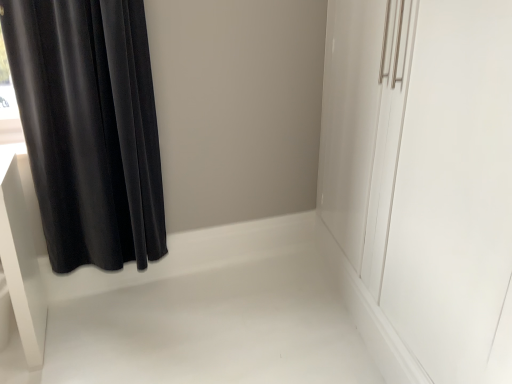
Question: Is the position of white glossy cabinet at right more distant than that of velvet black curtain at left?

Choices:
 (A) yes
 (B) no

Answer: (B)

Question: Does white glossy cabinet at right have a larger size compared to velvet black curtain at left?

Choices:
 (A) no
 (B) yes

Answer: (B)

Question: Is white glossy cabinet at right wider than velvet black curtain at left?

Choices:
 (A) no
 (B) yes

Answer: (B)

Question: From a real-world perspective, is white glossy cabinet at right located higher than velvet black curtain at left?

Choices:
 (A) yes
 (B) no

Answer: (B)

Question: From the image's perspective, is white glossy cabinet at right below velvet black curtain at left?

Choices:
 (A) no
 (B) yes

Answer: (B)

Question: Can you confirm if white glossy cabinet at right is thinner than velvet black curtain at left?

Choices:
 (A) no
 (B) yes

Answer: (A)

Question: Can you confirm if velvet black curtain at left is shorter than white glossy cabinet at right?

Choices:
 (A) yes
 (B) no

Answer: (A)

Question: Can you confirm if velvet black curtain at left is smaller than white glossy cabinet at right?

Choices:
 (A) yes
 (B) no

Answer: (A)

Question: Is velvet black curtain at left oriented away from white glossy cabinet at right?

Choices:
 (A) no
 (B) yes

Answer: (A)

Question: Is velvet black curtain at left to the right of white glossy cabinet at right from the viewer's perspective?

Choices:
 (A) no
 (B) yes

Answer: (A)

Question: Does velvet black curtain at left lie behind white glossy cabinet at right?

Choices:
 (A) yes
 (B) no

Answer: (A)

Question: Can you confirm if velvet black curtain at left is taller than white glossy cabinet at right?

Choices:
 (A) no
 (B) yes

Answer: (A)

Question: Is point [154, 104] closer or farther from the camera than point [482, 180]?

Choices:
 (A) farther
 (B) closer

Answer: (A)